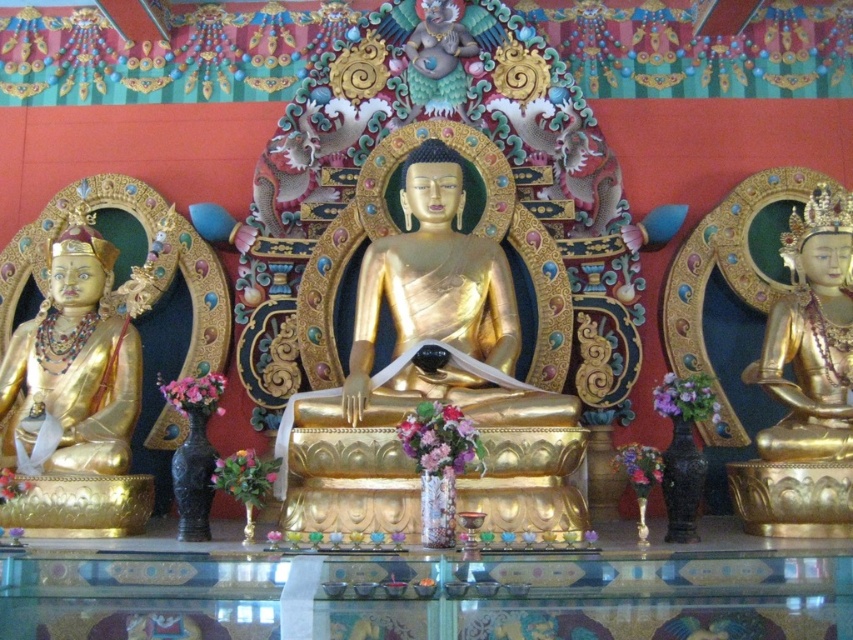
Is gold polished statue at center thinner than gold/gilded statue at left?

In fact, gold polished statue at center might be wider than gold/gilded statue at left.

Who is more distant from viewer, (395, 163) or (62, 272)?

The point (395, 163) is behind.

The image size is (853, 640). What are the coordinates of `gold polished statue at center` in the screenshot? It's located at (428, 342).

In the scene shown: Which of these two, gold/gilded statue at left or gold polished statue at right, stands shorter?

With less height is gold/gilded statue at left.

Consider the image. Can you confirm if gold/gilded statue at left is positioned above gold polished statue at right?

No.

Does point (79, 364) come in front of point (820, 436)?

No, (79, 364) is further to viewer.

I want to click on gold/gilded statue at left, so click(x=73, y=365).

Does gold polished statue at center have a smaller size compared to gold polished statue at right?

No, gold polished statue at center is not smaller than gold polished statue at right.

Is gold polished statue at center closer to camera compared to gold polished statue at right?

Yes, gold polished statue at center is closer to the viewer.

Describe the element at coordinates (428, 342) in the screenshot. I see `gold polished statue at center` at that location.

You are a GUI agent. You are given a task and a screenshot of the screen. Output one action in this format:
    pyautogui.click(x=<x>, y=<y>)
    Task: Click on the gold polished statue at center
    This screenshot has height=640, width=853.
    Given the screenshot: What is the action you would take?
    pyautogui.click(x=428, y=342)